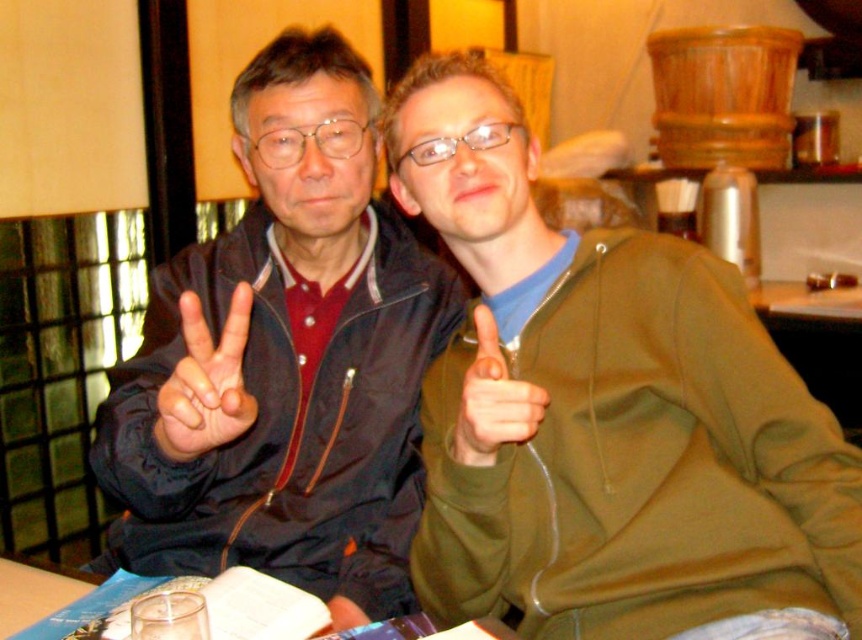
Which is above, matte black jacket at left or matte black hand at center?

matte black jacket at left is higher up.

Who is more forward, (319, 180) or (222, 352)?

Point (222, 352) is in front.

Does point (322, 333) come behind point (191, 371)?

Yes, point (322, 333) is behind point (191, 371).

I want to click on matte black jacket at left, so click(284, 358).

Between matte black jacket at left and matte green hand at center, which one is positioned higher?

matte black jacket at left is above.

Who is positioned more to the left, matte black jacket at left or matte green hand at center?

matte black jacket at left is more to the left.

Is point (150, 378) farther from camera compared to point (472, 451)?

Yes.

The image size is (862, 640). I want to click on matte black jacket at left, so click(284, 358).

Can you confirm if matte green hand at center is thinner than matte plastic hand at center?

No.

Between point (489, 372) and point (339, 604), which one is positioned behind?

The point (339, 604) is more distant.

You are a GUI agent. You are given a task and a screenshot of the screen. Output one action in this format:
    pyautogui.click(x=<x>, y=<y>)
    Task: Click on the matte green hand at center
    The image size is (862, 640).
    Given the screenshot: What is the action you would take?
    pyautogui.click(x=492, y=401)